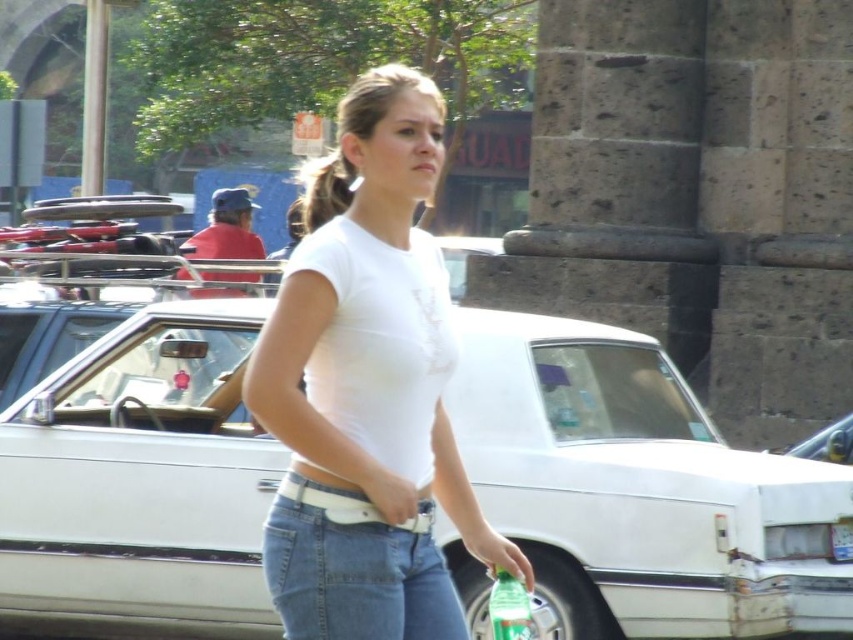
You are a pedestrian standing at the crosswalk and see the white matte car at center and the blonde hair at center in the scene. Which one is positioned more to the right side?

The white matte car at center is positioned more to the right side than the blonde hair at center.

You are a photographer trying to capture a closeup of the blonde hair at center and the green matte bottle at center. Which object should you zoom in on to ensure both are in frame without moving the camera?

The blonde hair at center is wider than the green matte bottle at center, so you should zoom in on the green matte bottle at center to ensure both are in frame without moving the camera.